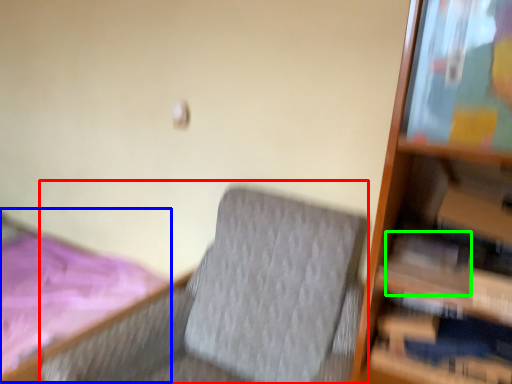
Question: Considering the real-world distances, which object is closest to rocking chair (highlighted by a red box)? bed (highlighted by a blue box) or paperback book (highlighted by a green box).

Choices:
 (A) bed
 (B) paperback book

Answer: (B)